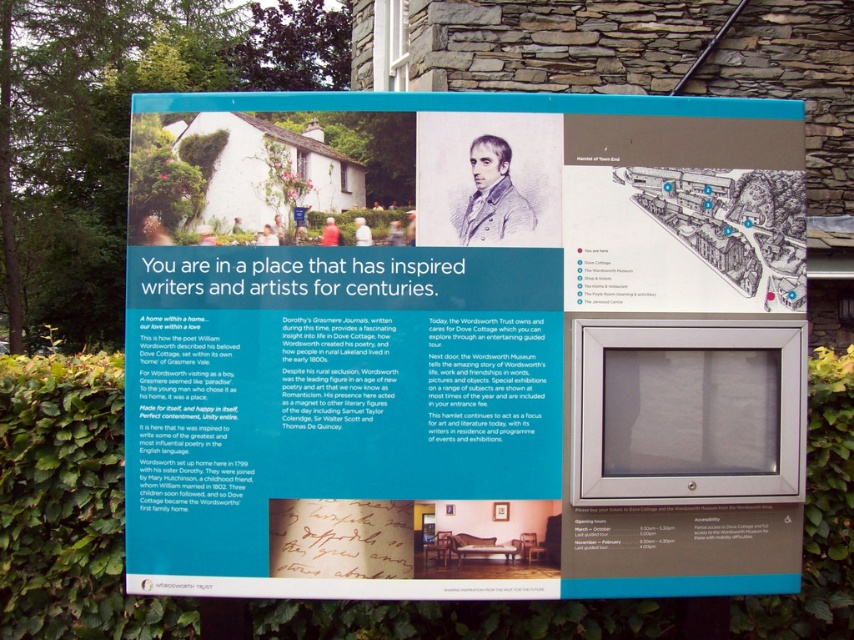
You are a visitor at the historical site and want to read the information on the white paper at center and the green leafy hedge at lower left. Which object is larger in size?

The green leafy hedge at lower left is larger in size compared to the white paper at center.

You are standing in front of the signboard and want to touch both the white paper at center and the green leafy hedge at lower left. Which object will your hand reach first?

The white paper at center is closer to the viewer than the green leafy hedge at lower left, so your hand will reach the white paper at center first.